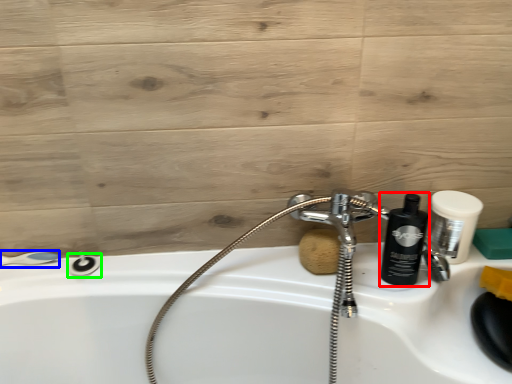
Question: Which is nearer to the shaving cream (highlighted by a red box)? shower (highlighted by a blue box) or shower (highlighted by a green box).

Choices:
 (A) shower
 (B) shower

Answer: (B)